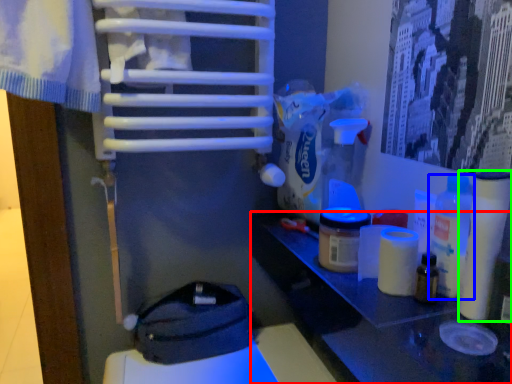
Question: Which is farther away from table (highlighted by a red box)? bottle (highlighted by a blue box) or toilet paper (highlighted by a green box)?

Choices:
 (A) bottle
 (B) toilet paper

Answer: (B)